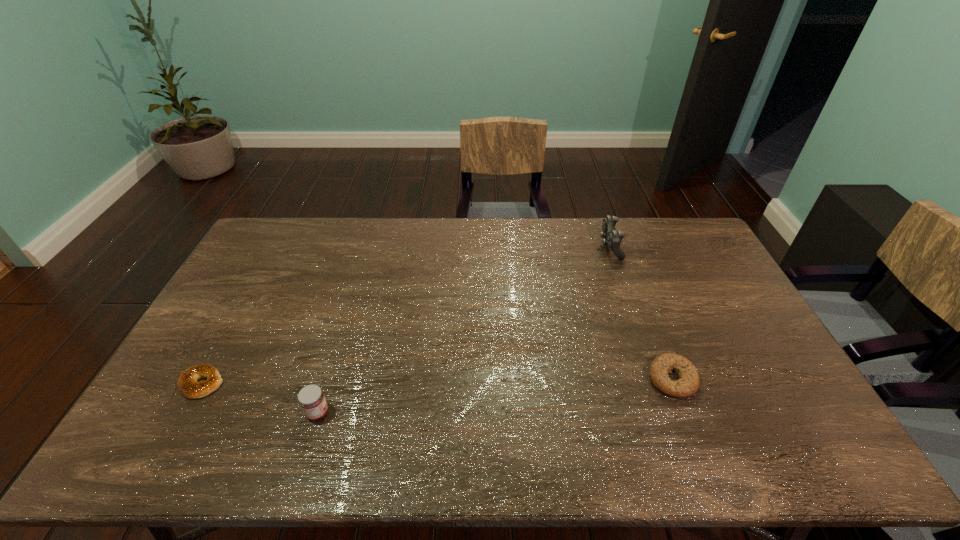
At what (x,y) coordinates should I click in order to perform the action: click on the tallest object. Please return your answer as a coordinate pair (x, y). This screenshot has width=960, height=540. Looking at the image, I should click on (x=613, y=238).

This screenshot has width=960, height=540. What are the coordinates of `control` in the screenshot? It's located at (613, 238).

The image size is (960, 540). I want to click on jam, so click(x=311, y=398).

The height and width of the screenshot is (540, 960). Find the location of `the nearest object`. the nearest object is located at coordinates (311, 398).

Where is `the taller bagel`? the taller bagel is located at coordinates (687, 385).

You are a GUI agent. You are given a task and a screenshot of the screen. Output one action in this format:
    pyautogui.click(x=<x>, y=<y>)
    Task: Click on the right bagel
    
    Given the screenshot: What is the action you would take?
    pyautogui.click(x=687, y=385)

This screenshot has width=960, height=540. Find the location of `the shorter bagel`. the shorter bagel is located at coordinates (187, 384).

You are a GUI agent. You are given a task and a screenshot of the screen. Output one action in this format:
    pyautogui.click(x=<x>, y=<y>)
    Task: Click on the leftmost object
    Image resolution: width=960 pixels, height=540 pixels.
    Given the screenshot: What is the action you would take?
    pyautogui.click(x=187, y=384)

The height and width of the screenshot is (540, 960). What are the coordinates of `vacant area located on the surface of the farthest object with buttons` in the screenshot? It's located at (584, 247).

Locate an element on the screen. The height and width of the screenshot is (540, 960). vacant space situated 0.320m on the surface of the farthest object with buttons is located at coordinates (514, 247).